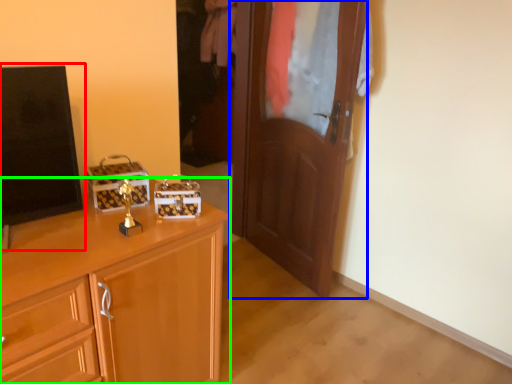
Question: Which object is positioned closest to tv show (highlighted by a red box)? Select from door (highlighted by a blue box) and cabinetry (highlighted by a green box).

Choices:
 (A) door
 (B) cabinetry

Answer: (B)